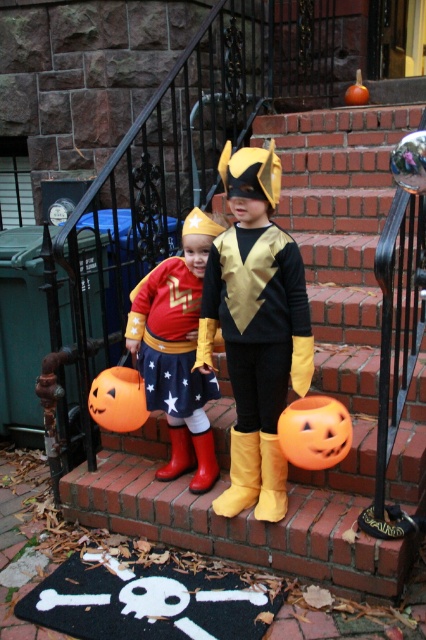
Question: Which object is positioned farthest from the metallic gold costume at center?

Choices:
 (A) brick stairs at center
 (B) smooth orange pumpkin at upper right
 (C) matte gold costume at center
 (D) orange matte pumpkin at center

Answer: (B)

Question: Is matte gold costume at center thinner than smooth orange pumpkin at upper right?

Choices:
 (A) no
 (B) yes

Answer: (A)

Question: Can you confirm if brick stairs at center is wider than smooth orange pumpkin at upper right?

Choices:
 (A) yes
 (B) no

Answer: (A)

Question: Which point appears closest to the camera in this image?

Choices:
 (A) (121, 410)
 (B) (164, 328)
 (C) (227, 148)
 (D) (287, 458)

Answer: (D)

Question: Is metallic gold costume at center wider than orange matte pumpkin at lower center?

Choices:
 (A) no
 (B) yes

Answer: (B)

Question: Which point is closer to the camera?

Choices:
 (A) orange matte pumpkin at center
 (B) smooth orange pumpkin at upper right

Answer: (A)